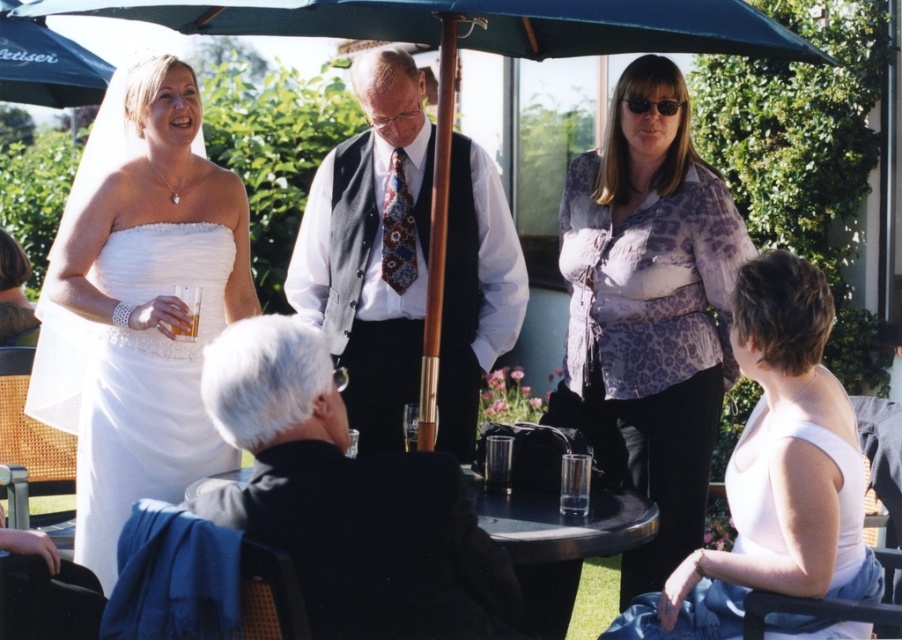
You are a photographer at a wedding reception and need to capture a group photo. You have two subjects wearing white clothing. The first is the white shirt with vest at center and the second is the white matte tank top at lower right. Which subject should you focus on if you want to ensure the largest clothing detail is visible?

The white shirt with vest at center is larger in size than the white matte tank top at lower right, so focusing on the white shirt with vest at center will ensure the largest clothing detail is visible.